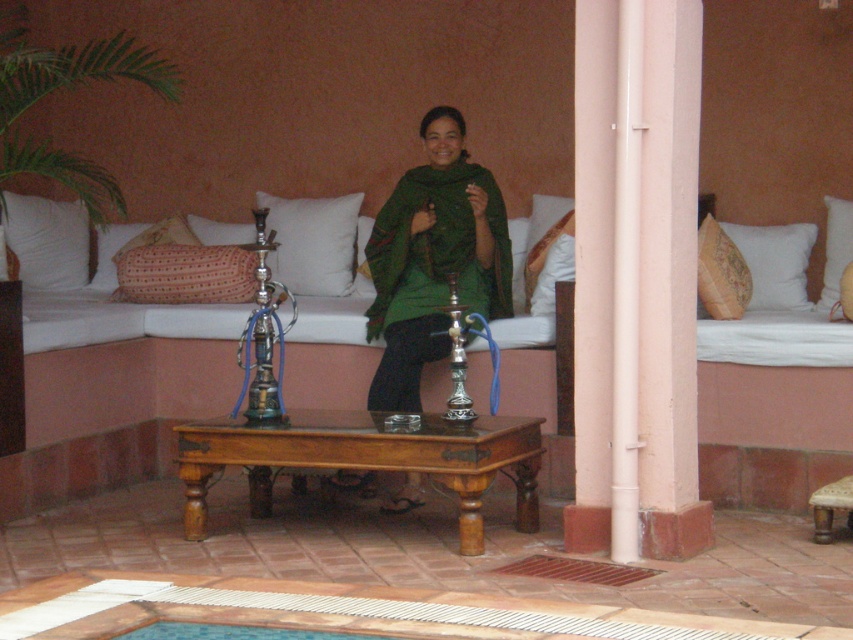
You are sitting on the knitted fabric pillow at center and want to reach the wooden stool at lower right. Which direction should you move to get there?

You should move to the right to reach the wooden stool at lower right since it is located to the right of the knitted fabric pillow at center.

You are planning to place a tall plant in this room. The plant requires a minimum height clearance of 2 meters. Given the presence of the white smooth pillar at center and the brown wooden table at center, which object might obstruct the placement of the plant if it exceeds the height requirement?

The white smooth pillar at center is taller than the brown wooden table at center, so if the plant exceeds 2 meters, it might hit the white smooth pillar at center first since it is taller.

You are sitting on the wooden stool at lower right and want to reach the nearest hookah on the wooden coffee table. Can you determine which hookah you should reach for?

The wooden stool at lower right is located at point (x=828, y=506), so you should reach for the hookah that is closer to this coordinate on the wooden coffee table.